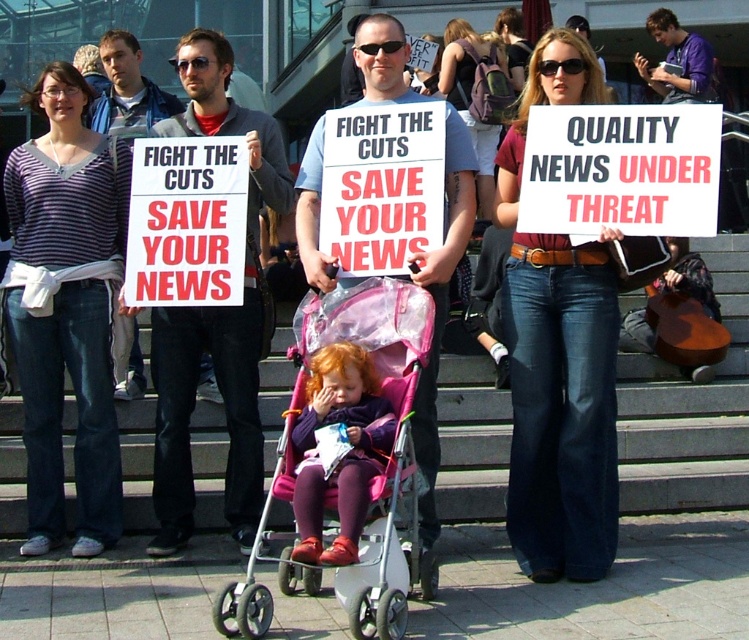
What is located at the point with coordinates (565, 396) in the image?

The point at coordinates (565, 396) is on denim jeans at center.

You are a photographer trying to capture a clear photo of the white paper sign at center and the purple fleece jacket at center. Based on their sizes, which object should you focus on first to ensure both are in frame without zooming?

The white paper sign at center might be wider than purple fleece jacket at center, so you should focus on the white paper sign at center first to ensure it fits in the frame without zooming.

You are a photographer trying to capture the protest scene. You notice two points in the image at coordinates point [595,83] and point [706,64]. Which point is closer to your camera?

Point [595,83] is closer to the camera than point [706,64].